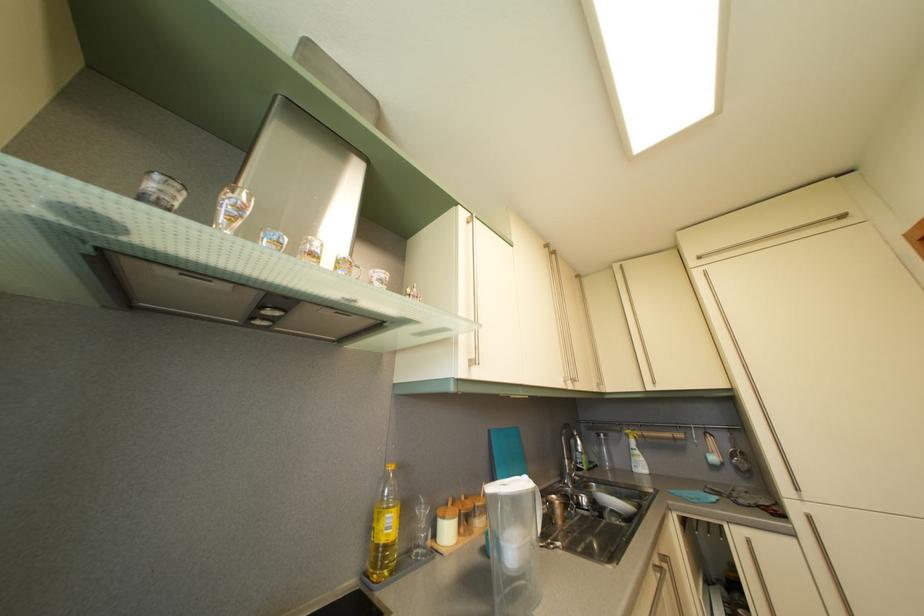
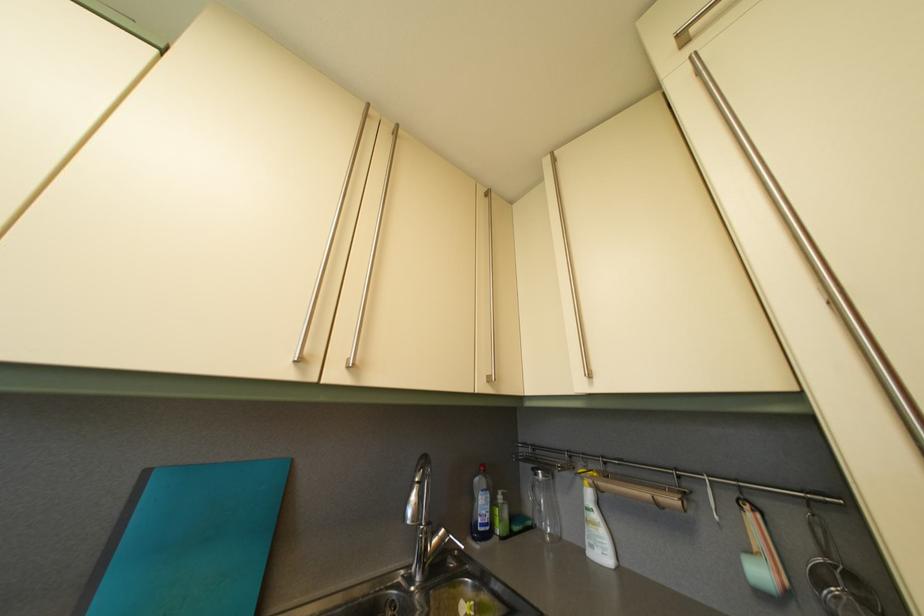
Which direction would the cameraman need to move to produce the second image?

The cameraman moved toward right, forward.